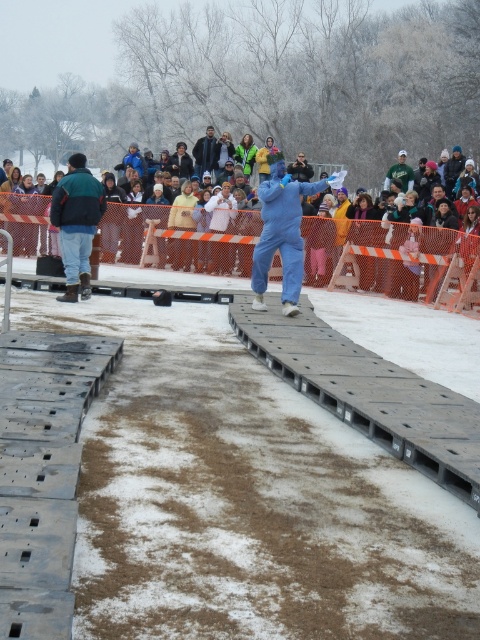
Between point (266, 250) and point (52, 209), which one is positioned in front?

Point (266, 250) is more forward.

Find the location of a particular element. The width and height of the screenshot is (480, 640). blue matte jumpsuit at center is located at coordinates (283, 234).

Where is `blue matte jumpsuit at center`? Image resolution: width=480 pixels, height=640 pixels. blue matte jumpsuit at center is located at coordinates (283, 234).

Does multicolored fabric crowd at upper center come in front of jeans at left?

That is True.

How much distance is there between multicolored fabric crowd at upper center and jeans at left?

multicolored fabric crowd at upper center and jeans at left are 6.14 meters apart from each other.

At what (x,y) coordinates should I click in order to perform the action: click on multicolored fabric crowd at upper center. Please return your answer as a coordinate pair (x, y). Looking at the image, I should click on (395, 252).

Is multicolored fabric crowd at upper center further to camera compared to blue matte jumpsuit at center?

Yes, multicolored fabric crowd at upper center is behind blue matte jumpsuit at center.

Does multicolored fabric crowd at upper center appear on the right side of blue matte jumpsuit at center?

Incorrect, multicolored fabric crowd at upper center is not on the right side of blue matte jumpsuit at center.

Is point (416, 260) more distant than point (285, 177)?

Yes, point (416, 260) is behind point (285, 177).

The width and height of the screenshot is (480, 640). In order to click on multicolored fabric crowd at upper center in this screenshot , I will do `click(395, 252)`.